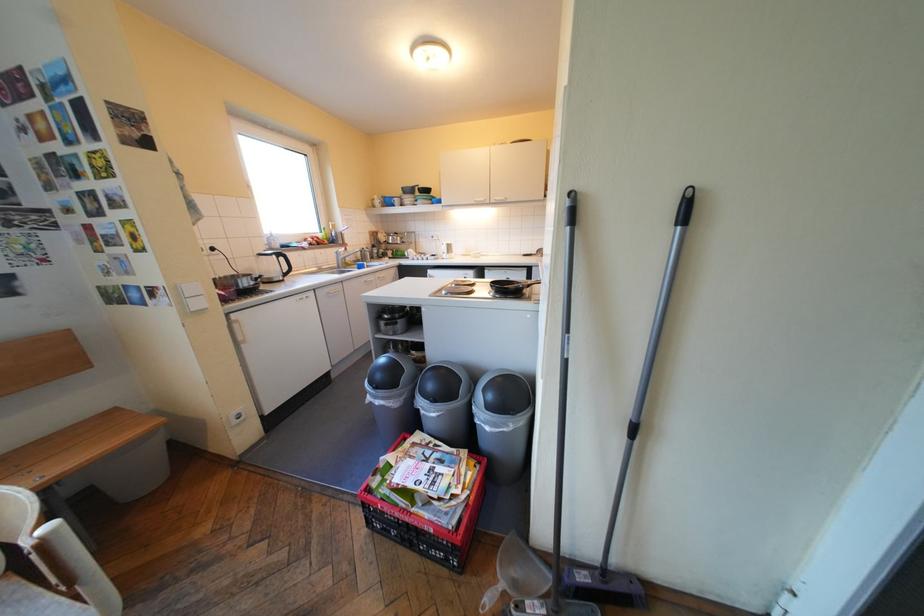
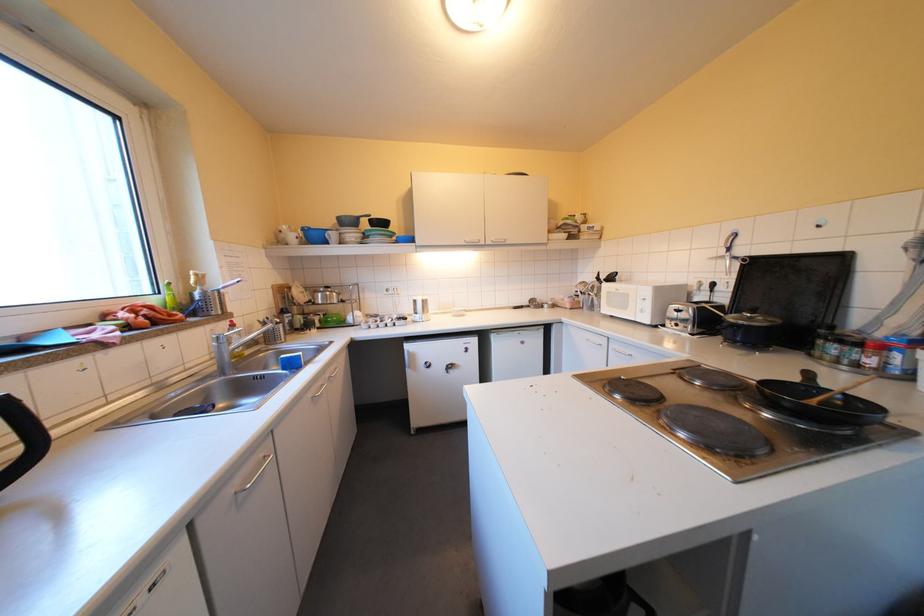
Find the pixel in the second image that matches pixel 298 273 in the first image.

(17, 479)